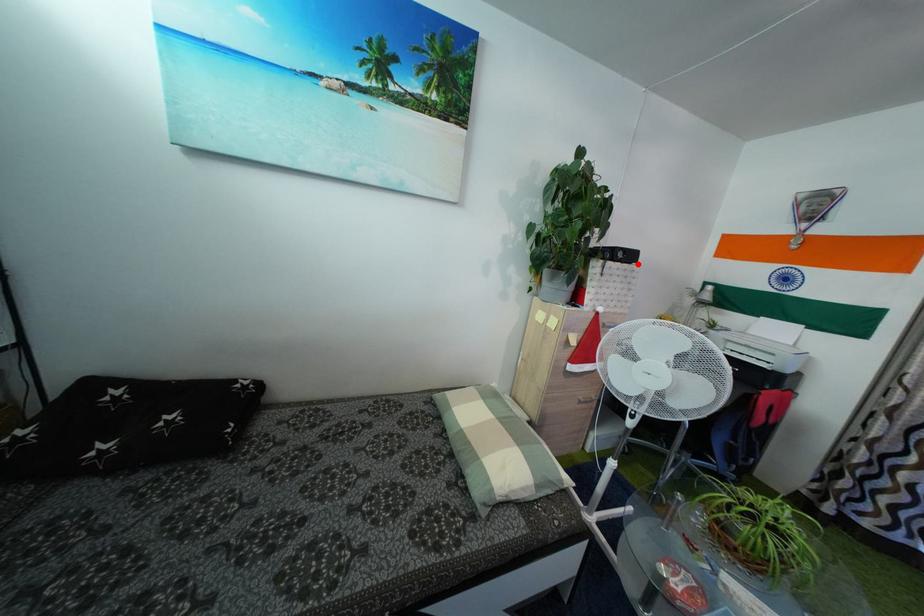
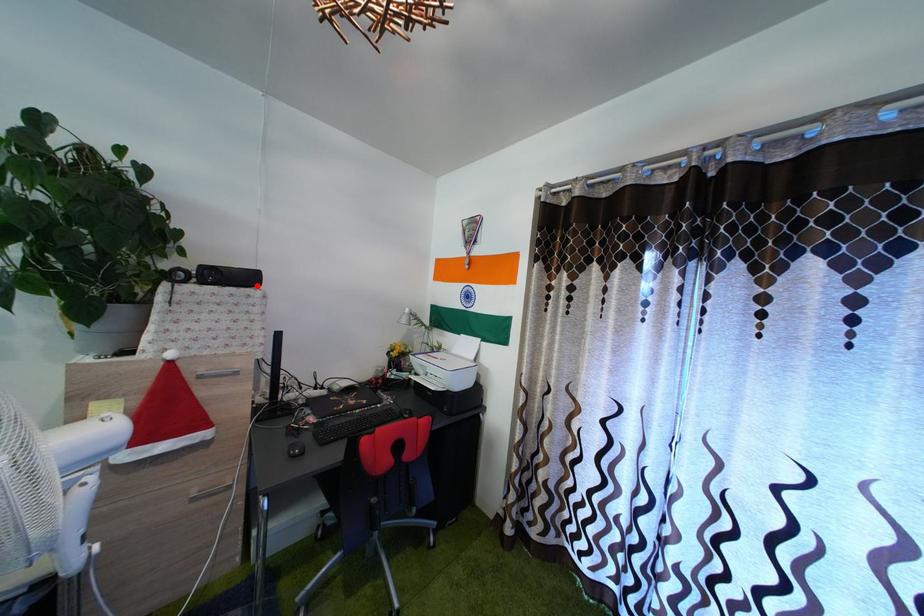
I am providing you with two images of the same scene from different viewpoints. A red point is marked on the first image and another point is marked on the second image. Are the points marked in image1 and image2 representing the same 3D position?

Yes